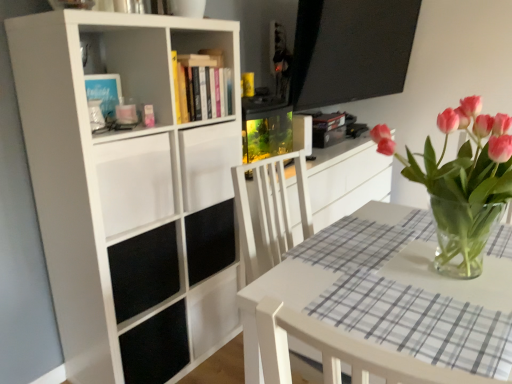
Question: Considering the positions of point (108, 177) and point (56, 251), is point (108, 177) closer or farther from the camera than point (56, 251)?

Choices:
 (A) closer
 (B) farther

Answer: (A)

Question: Relative to white matte bookcase at left, is white matte drawer at upper left in front or behind?

Choices:
 (A) front
 (B) behind

Answer: (B)

Question: Which object is the farthest from the white matte bookcase at left?

Choices:
 (A) pink glass vase at center
 (B) hardcover books at upper center
 (C) white glossy table at center
 (D) white matte drawer at upper left
 (E) white wood chair at lower right

Answer: (E)

Question: Which of these objects is positioned farthest from the white glossy table at center?

Choices:
 (A) pink glass vase at center
 (B) hardcover books at upper center
 (C) white matte bookcase at left
 (D) white wood chair at lower right
 (E) white matte drawer at upper left

Answer: (B)